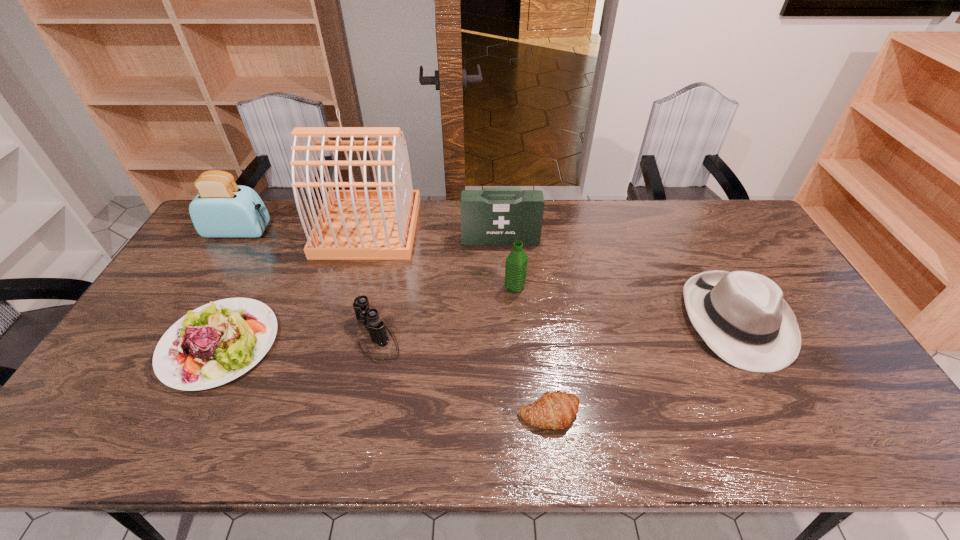
Locate an element on the screen. This screenshot has width=960, height=540. free space located with an open door on the birdcage is located at coordinates (446, 227).

Locate an element on the screen. The width and height of the screenshot is (960, 540). free space located on the side of the toaster with the lever is located at coordinates (368, 231).

I want to click on free location located on the front-facing side of the first-aid kit, so click(x=502, y=281).

Where is `free location located 0.150m on the back of the water bottle`? This screenshot has width=960, height=540. free location located 0.150m on the back of the water bottle is located at coordinates (512, 249).

The height and width of the screenshot is (540, 960). Identify the location of blank area located 0.120m on the front-facing side of the fedora. (787, 416).

The image size is (960, 540). In order to click on vacant region located on the front of the binoculars in this screenshot , I will do `click(355, 444)`.

Identify the location of free space located on the back of the salad plate. This screenshot has height=540, width=960. (270, 247).

Where is `vacant space located 0.090m on the back of the shortest object`? vacant space located 0.090m on the back of the shortest object is located at coordinates (543, 366).

The width and height of the screenshot is (960, 540). In order to click on birdcage at the far edge in this screenshot , I will do [378, 224].

I want to click on toaster present at the far edge, so tap(222, 209).